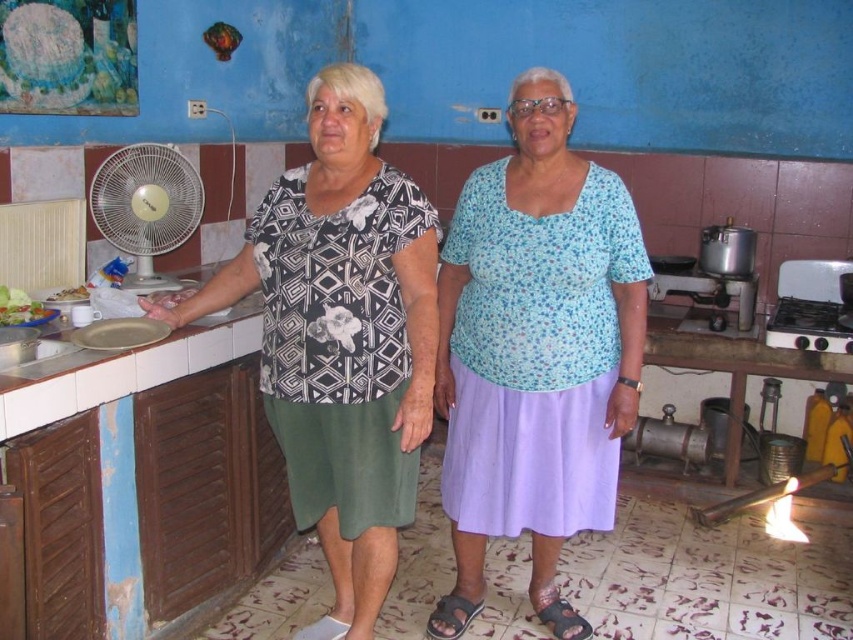
You are standing in the kitchen and want to reach the white plastic fan at left without moving the blue floral blouse at center. Is it possible?

The blue floral blouse at center is below the white plastic fan at left, so you can reach the white plastic fan at left without moving the blue floral blouse at center as it is positioned lower.

You are a photographer standing 1.5 meters away from the camera. You want to take a photo of the blue floral blouse at center. Can you reach the camera without moving your feet?

The blue floral blouse at center and camera are 2.16 meters apart from each other. Since you are already 1.5 meters away from the camera, you would need to extend your arm or use a tool to reach the blouse, which is an additional 0.66 meters away. Therefore, you cannot reach the camera without moving your feet.